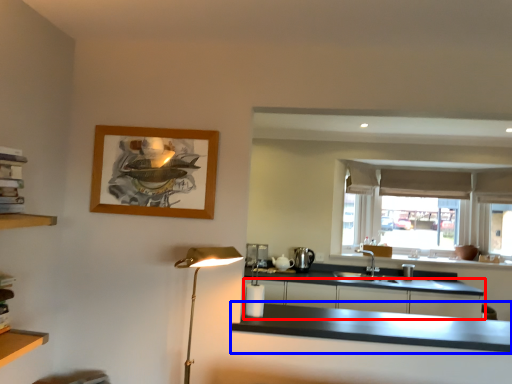
Question: Which object is closer to the camera taking this photo, cabinetry (highlighted by a red box) or countertop (highlighted by a blue box)?

Choices:
 (A) cabinetry
 (B) countertop

Answer: (B)